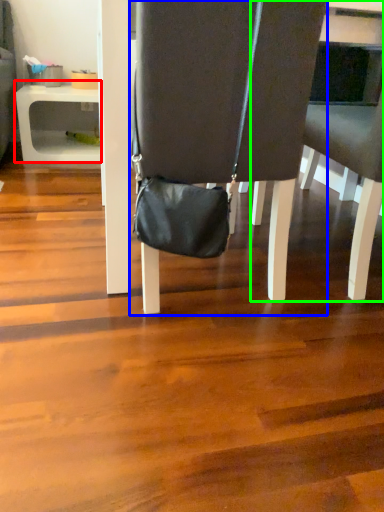
Question: Which object is the farthest from table (highlighted by a red box)? Choose among these: chair (highlighted by a blue box) or chair (highlighted by a green box).

Choices:
 (A) chair
 (B) chair

Answer: (B)